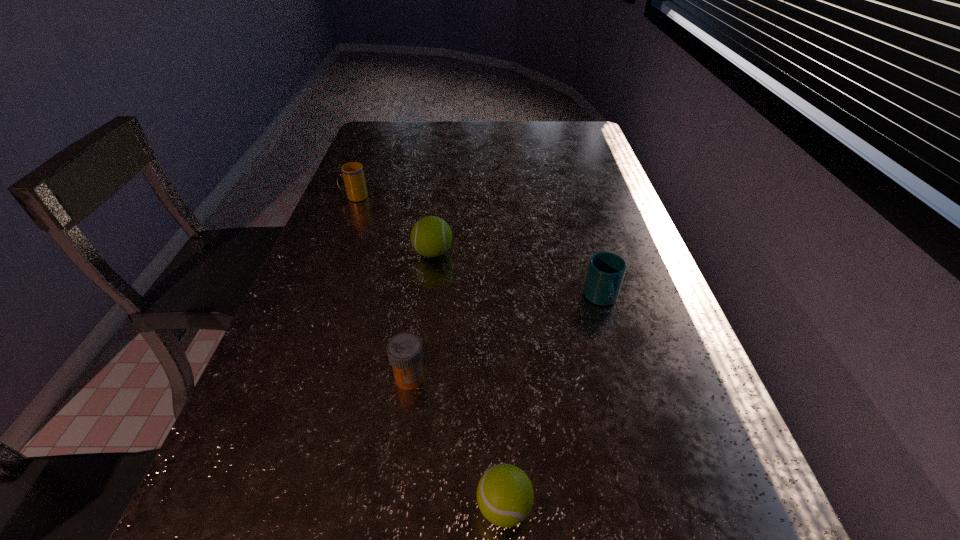
This screenshot has height=540, width=960. In order to click on free space between the second nearest object and the second object from right to left in this screenshot , I will do `click(457, 442)`.

I want to click on free space between the farther cup and the fourth farthest object, so click(x=382, y=287).

Where is `free space between the farther tennis ball and the medicine`? This screenshot has height=540, width=960. free space between the farther tennis ball and the medicine is located at coordinates (421, 315).

This screenshot has height=540, width=960. Identify the location of vacant region between the leftmost object and the fourth farthest object. (382, 287).

Where is `empty location between the leftmost object and the third nearest object`? empty location between the leftmost object and the third nearest object is located at coordinates (478, 248).

You are a GUI agent. You are given a task and a screenshot of the screen. Output one action in this format:
    pyautogui.click(x=<x>, y=<y>)
    Task: Click on the free space between the medicine and the right cup
    The height and width of the screenshot is (540, 960).
    Given the screenshot: What is the action you would take?
    pyautogui.click(x=506, y=338)

Where is `empty space between the nearest object and the fourth farthest object`? The width and height of the screenshot is (960, 540). empty space between the nearest object and the fourth farthest object is located at coordinates (457, 442).

The height and width of the screenshot is (540, 960). In order to click on free space between the shorter tennis ball and the fourth farthest object in this screenshot , I will do `click(457, 442)`.

Where is `unoccupied position between the nearer tennis ball and the third nearest object`? The width and height of the screenshot is (960, 540). unoccupied position between the nearer tennis ball and the third nearest object is located at coordinates (553, 403).

Point out which object is positioned as the second nearest to the right tennis ball. Please provide its 2D coordinates. Your answer should be formatted as a tuple, i.e. [(x, y)], where the tuple contains the x and y coordinates of a point satisfying the conditions above.

[(606, 270)]